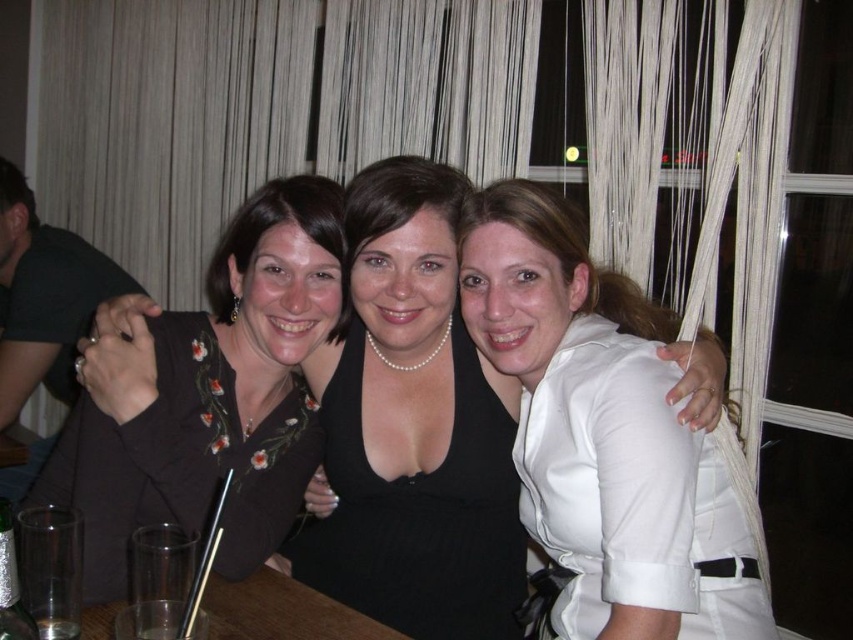
Question: Which of the following is the farthest from the observer?

Choices:
 (A) silver metallic ring at left
 (B) dark brown fabric shirt at left
 (C) white satin blouse at upper right
 (D) clear glass table at center

Answer: (A)

Question: Which object is farther from the camera taking this photo?

Choices:
 (A) white satin blouse at upper right
 (B) clear glass at lower left
 (C) silver metallic ring at left

Answer: (C)

Question: Which object is the closest to the clear glass at lower left?

Choices:
 (A) silver metallic ring at left
 (B) clear glass table at center

Answer: (B)

Question: Is silver metallic ring at left in front of clear glass at lower left?

Choices:
 (A) no
 (B) yes

Answer: (A)

Question: From the image, what is the correct spatial relationship of dark brown fabric shirt at left in relation to clear glass at lower left?

Choices:
 (A) below
 (B) above

Answer: (B)

Question: Can you confirm if white satin blouse at upper right is positioned below clear glass at lower left?

Choices:
 (A) no
 (B) yes

Answer: (A)